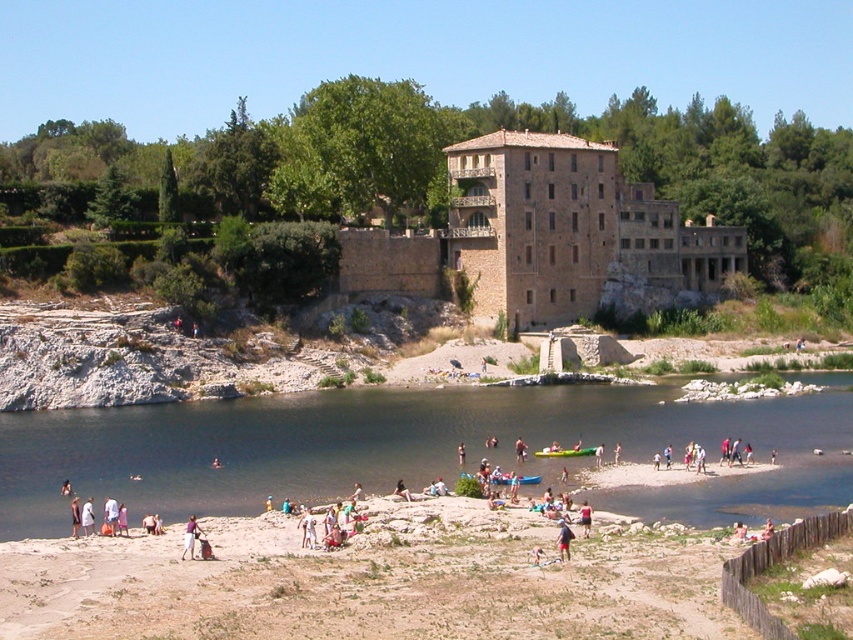
You are standing at the camera position and want to reach the point marked as point (x=86, y=536). If you walk straight ahead, will you reach that point before walking 60 meters?

Yes, because the distance between the camera and point (x=86, y=536) is 59.80 meters, which is less than 60 meters.

You are a photographer planning to capture a closeup shot of the white cotton dress at lower center and the red fabric bag at center. Since you want to focus on the dress, which object should you place closer to the camera?

You should place the white cotton dress at lower center closer to the camera because it is larger in size than the red fabric bag at center, allowing it to be the main focus.

You are standing at the riverside and see the light pink fabric at lower center. Where exactly is it positioned in relation to your viewpoint?

The light pink fabric at lower center is positioned at coordinates point (190, 538).